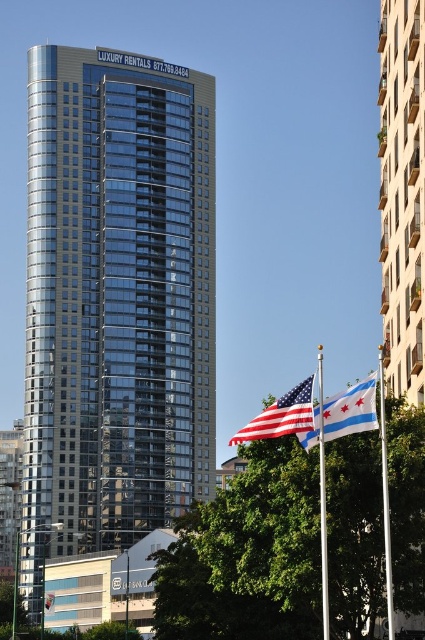
Which is more to the right, green leafy tree at lower center or american flag at center?

american flag at center is more to the right.

Does green leafy tree at lower center have a lesser width compared to american flag at center?

No, green leafy tree at lower center is not thinner than american flag at center.

I want to click on green leafy tree at lower center, so click(248, 554).

Where is `green leafy tree at lower center`? This screenshot has width=425, height=640. green leafy tree at lower center is located at coordinates (248, 554).

Is shiny glass building at center smaller than glassy concrete building at right?

Actually, shiny glass building at center might be larger than glassy concrete building at right.

At what (x,y) coordinates should I click in order to perform the action: click on shiny glass building at center. Please return your answer as a coordinate pair (x, y). Looking at the image, I should click on (116, 301).

Identify the location of shiny glass building at center. Image resolution: width=425 pixels, height=640 pixels. (116, 301).

Does shiny glass building at center appear over blue and white striped fabric at center?

Correct, shiny glass building at center is located above blue and white striped fabric at center.

Who is higher up, shiny glass building at center or blue and white striped fabric at center?

shiny glass building at center is higher up.

Who is more distant from viewer, (172, 438) or (363, 397)?

Point (172, 438)

Locate an element on the screen. shiny glass building at center is located at coordinates (116, 301).